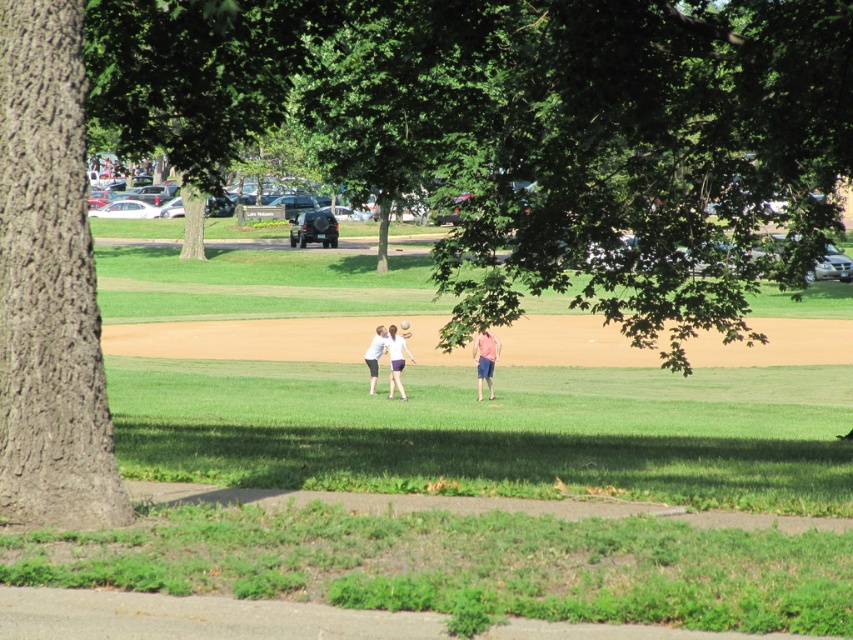
Consider the image. How much distance is there between smooth brown bark at left and green leafy tree at upper left?

They are 5.10 meters apart.

Is smooth brown bark at left shorter than green leafy tree at upper left?

Correct, smooth brown bark at left is not as tall as green leafy tree at upper left.

I want to click on smooth brown bark at left, so click(x=49, y=282).

Can you confirm if green leafy tree at upper left is positioned above white cotton shirt at center?

Yes, green leafy tree at upper left is above white cotton shirt at center.

Is point (276, 45) positioned behind point (384, 342)?

No, it is in front of (384, 342).

The image size is (853, 640). I want to click on green leafy tree at upper left, so click(x=195, y=81).

Which is below, white cotton shirt at center or white matte shirt at center?

white matte shirt at center

Can you confirm if white cotton shirt at center is positioned to the left of white matte shirt at center?

No, white cotton shirt at center is not to the left of white matte shirt at center.

Consider the image. Who is more forward, (386, 337) or (386, 344)?

Positioned in front is point (386, 344).

This screenshot has height=640, width=853. In order to click on white cotton shirt at center in this screenshot , I will do `click(387, 353)`.